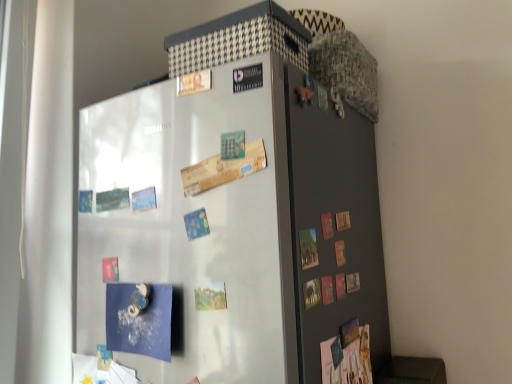
Question: Is satin silver fridge at center outside of matte gray door at right?

Choices:
 (A) no
 (B) yes

Answer: (B)

Question: Is satin silver fridge at center taller than matte gray door at right?

Choices:
 (A) yes
 (B) no

Answer: (A)

Question: Is satin silver fridge at center oriented away from matte gray door at right?

Choices:
 (A) yes
 (B) no

Answer: (B)

Question: From a real-world perspective, is satin silver fridge at center located higher than matte gray door at right?

Choices:
 (A) no
 (B) yes

Answer: (A)

Question: Can you confirm if satin silver fridge at center is smaller than matte gray door at right?

Choices:
 (A) yes
 (B) no

Answer: (B)

Question: From a real-world perspective, is satin silver fridge at center beneath matte gray door at right?

Choices:
 (A) yes
 (B) no

Answer: (A)

Question: Considering the relative sizes of matte gray door at right and satin silver fridge at center in the image provided, is matte gray door at right smaller than satin silver fridge at center?

Choices:
 (A) no
 (B) yes

Answer: (B)

Question: Is the position of matte gray door at right more distant than that of satin silver fridge at center?

Choices:
 (A) yes
 (B) no

Answer: (A)

Question: Can you confirm if matte gray door at right is shorter than satin silver fridge at center?

Choices:
 (A) no
 (B) yes

Answer: (B)

Question: Can you confirm if matte gray door at right is taller than satin silver fridge at center?

Choices:
 (A) no
 (B) yes

Answer: (A)

Question: Is matte gray door at right turned away from satin silver fridge at center?

Choices:
 (A) no
 (B) yes

Answer: (B)

Question: Are matte gray door at right and satin silver fridge at center far apart?

Choices:
 (A) no
 (B) yes

Answer: (A)

Question: Is satin silver fridge at center to the left or to the right of matte gray door at right in the image?

Choices:
 (A) left
 (B) right

Answer: (A)